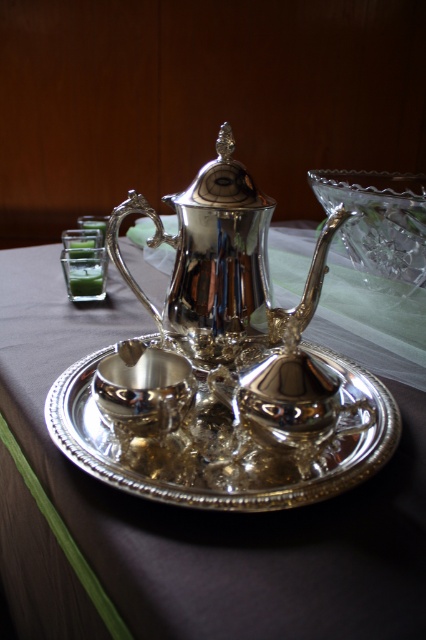
In the scene shown: You are a server preparing to place a dessert plate on the table. The dessert plate has a diameter of 8 inches. Can you fit the dessert plate between the shiny silver tray at center and the polished silver saucer at center without touching either?

The shiny silver tray at center and polished silver saucer at center are 4.66 inches apart from each other. Since the dessert plate has a diameter of 8 inches, which is larger than the space between them, it cannot fit between them without touching either object.

Based on the photo, you are setting up a tea service and notice the shiny silver tray at center and the polished silver saucer at center. Which object is positioned lower in the arrangement?

The shiny silver tray at center is positioned below the polished silver saucer at center, so the tray is lower.

You are a guest at a tea party and want to reach for the shiny silver tray at center and the polished silver sugar bowl at center. Which object will your hand touch first?

The shiny silver tray at center is closer to you than the polished silver sugar bowl at center, so your hand will touch the shiny silver tray at center first.